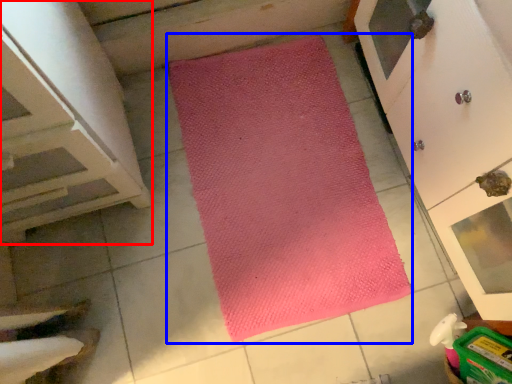
Question: Which object appears closest to the camera in this image, cabinetry (highlighted by a red box) or mat (highlighted by a blue box)?

Choices:
 (A) cabinetry
 (B) mat

Answer: (A)